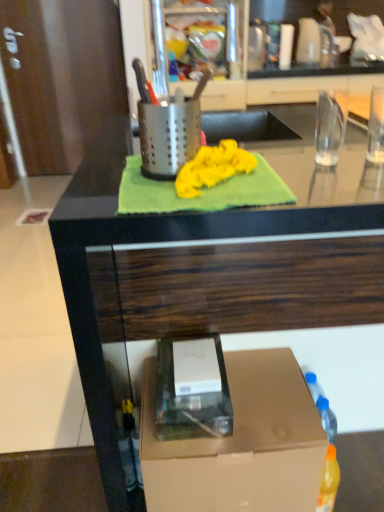
Question: Considering the relative sizes of yellow fabric at center and yellow fabric at center in the image provided, is yellow fabric at center wider than yellow fabric at center?

Choices:
 (A) yes
 (B) no

Answer: (A)

Question: Is yellow fabric at center aimed at yellow fabric at center?

Choices:
 (A) yes
 (B) no

Answer: (A)

Question: From a real-world perspective, does yellow fabric at center stand above yellow fabric at center?

Choices:
 (A) yes
 (B) no

Answer: (B)

Question: Is yellow fabric at center turned away from yellow fabric at center?

Choices:
 (A) yes
 (B) no

Answer: (A)

Question: Is yellow fabric at center further to camera compared to yellow fabric at center?

Choices:
 (A) yes
 (B) no

Answer: (B)

Question: From the image's perspective, is yellow fabric at center under yellow fabric at center?

Choices:
 (A) yes
 (B) no

Answer: (A)

Question: Is yellow fabric at center taller than brown cardboard box at lower right?

Choices:
 (A) yes
 (B) no

Answer: (B)

Question: From the image's perspective, does yellow fabric at center appear higher than brown cardboard box at lower right?

Choices:
 (A) yes
 (B) no

Answer: (A)

Question: Is yellow fabric at center facing away from brown cardboard box at lower right?

Choices:
 (A) yes
 (B) no

Answer: (B)

Question: Considering the relative sizes of yellow fabric at center and brown cardboard box at lower right in the image provided, is yellow fabric at center wider than brown cardboard box at lower right?

Choices:
 (A) yes
 (B) no

Answer: (B)

Question: Is yellow fabric at center not inside brown cardboard box at lower right?

Choices:
 (A) yes
 (B) no

Answer: (A)

Question: Is yellow fabric at center oriented towards brown cardboard box at lower right?

Choices:
 (A) yes
 (B) no

Answer: (B)

Question: From the image's perspective, is yellow fabric at center under brown cardboard box at lower right?

Choices:
 (A) no
 (B) yes

Answer: (A)